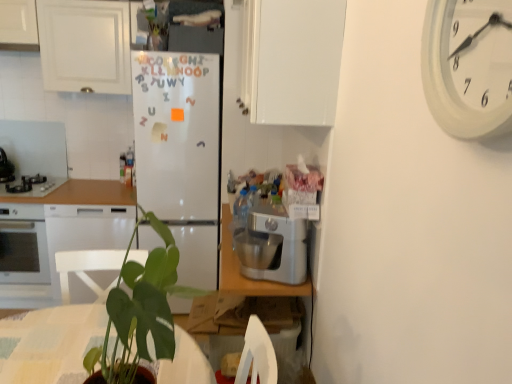
Identify the location of blank space above wooden countertop at left (from a real-world perspective). This screenshot has height=384, width=512. (98, 185).